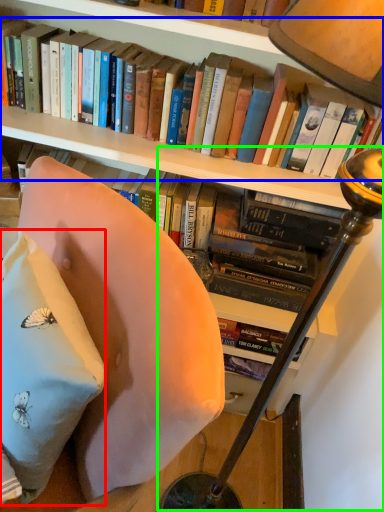
Question: Which object is the farthest from pillow (highlighted by a red box)? Choose among these: book (highlighted by a blue box) or table lamp (highlighted by a green box).

Choices:
 (A) book
 (B) table lamp

Answer: (A)